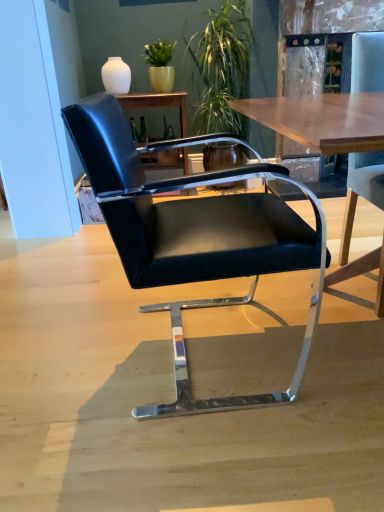
Question: Considering the positions of matte black chair at center and green leafy plant at upper center in the image, is matte black chair at center bigger or smaller than green leafy plant at upper center?

Choices:
 (A) small
 (B) big

Answer: (A)

Question: Considering the relative positions of matte black chair at center and green leafy plant at upper center in the image provided, is matte black chair at center to the left or to the right of green leafy plant at upper center?

Choices:
 (A) left
 (B) right

Answer: (A)

Question: Which is farther from the black leather chair at center, the second chair viewed from the right?

Choices:
 (A) black leather chair at right, the 2th chair when ordered from left to right
 (B) matte black chair at center
 (C) green leafy plant at upper center

Answer: (B)

Question: Considering the real-world distances, which object is farthest from the green leafy plant at upper center?

Choices:
 (A) black leather chair at center, the 1th chair in the left-to-right sequence
 (B) matte black chair at center
 (C) black leather chair at right, which appears as the first chair when viewed from the right

Answer: (A)